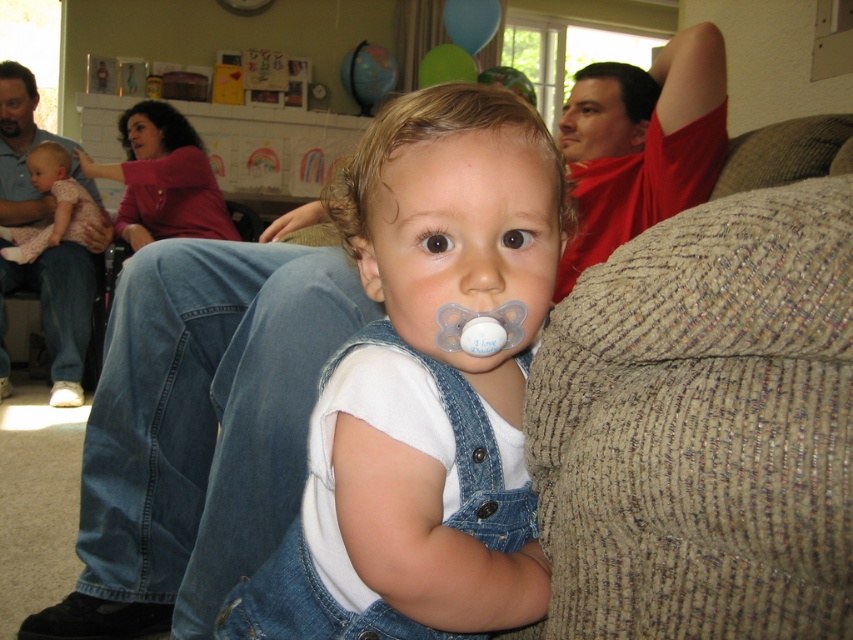
Can you confirm if denim overalls at center is bigger than matte pink dress at left?

Incorrect, denim overalls at center is not larger than matte pink dress at left.

Is denim overalls at center behind matte pink dress at left?

No, denim overalls at center is closer to the viewer.

Image resolution: width=853 pixels, height=640 pixels. In order to click on denim overalls at center in this screenshot , I will do `click(426, 387)`.